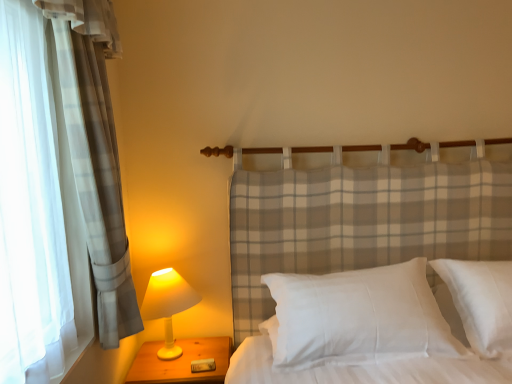
You are a GUI agent. You are given a task and a screenshot of the screen. Output one action in this format:
    pyautogui.click(x=<x>, y=<y>)
    Task: Click on the free space above wooden nightstand at lower left (from a real-world perspective)
    This screenshot has width=512, height=384.
    Given the screenshot: What is the action you would take?
    pyautogui.click(x=179, y=341)